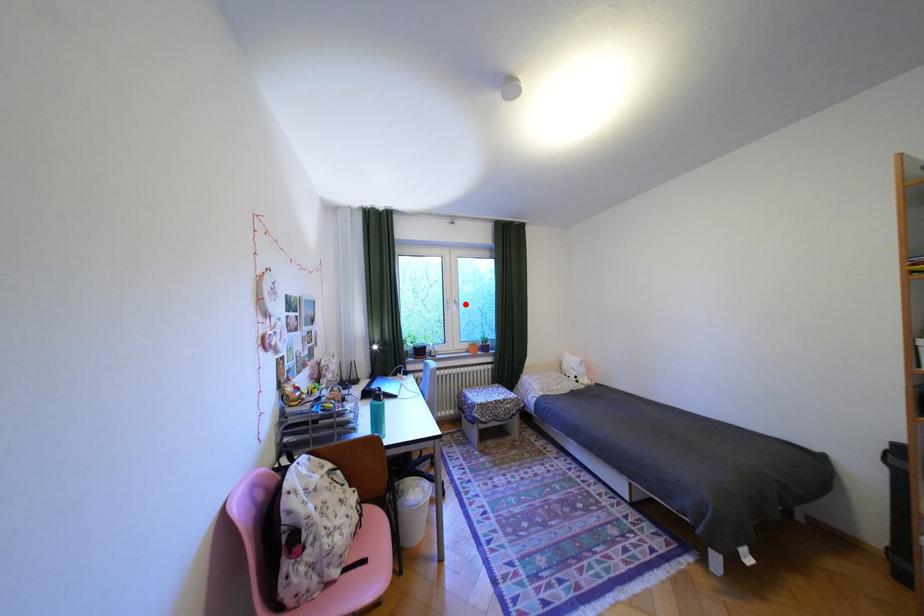
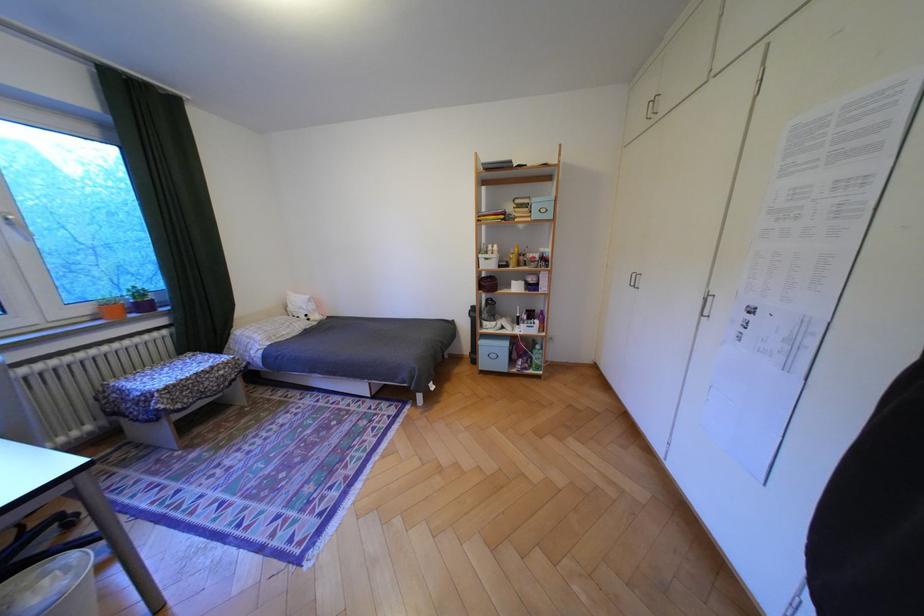
In the second image, find the point that corresponds to the highlighted location in the first image.

(18, 227)